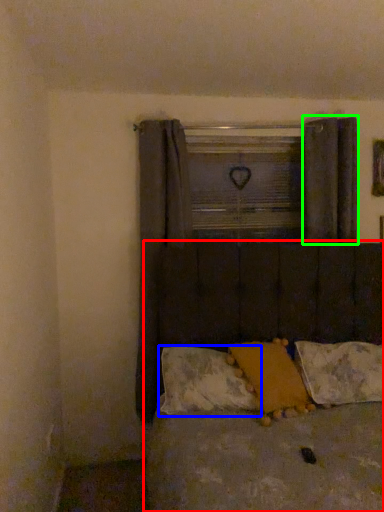
Question: Which object is positioned farthest from bed (highlighted by a red box)? Select from pillow (highlighted by a blue box) and curtain (highlighted by a green box).

Choices:
 (A) pillow
 (B) curtain

Answer: (B)